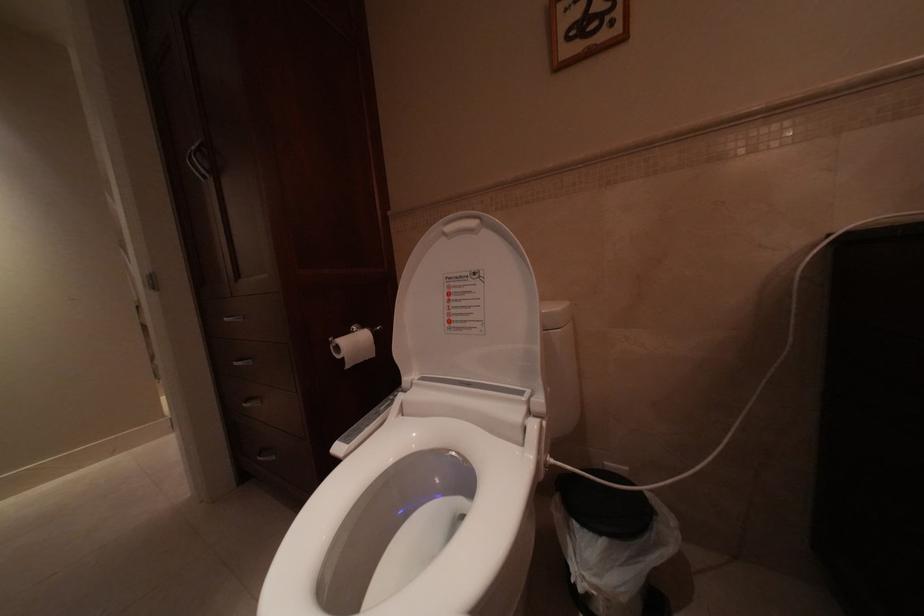
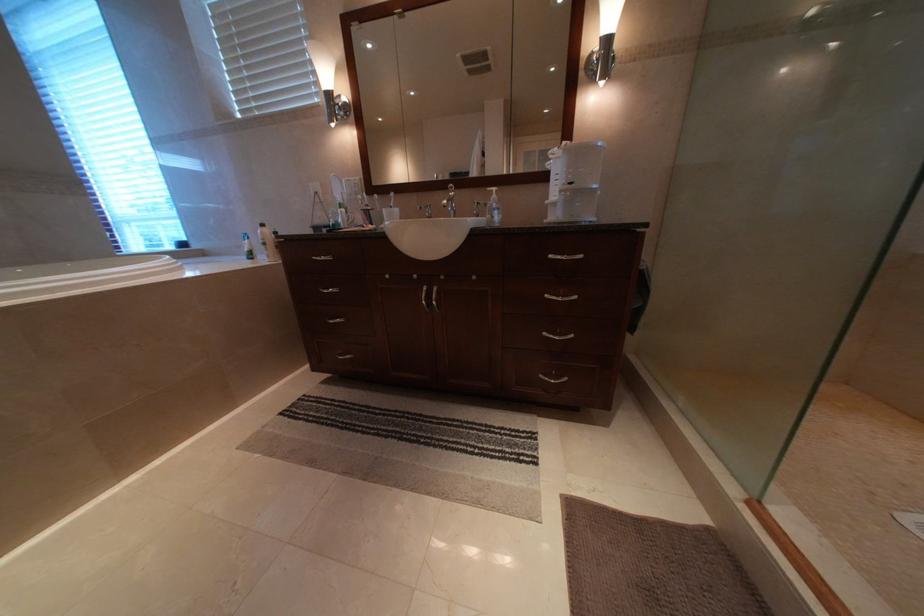
Which direction would the cameraman need to move to produce the second image?

The cameraman walked toward left, forward.